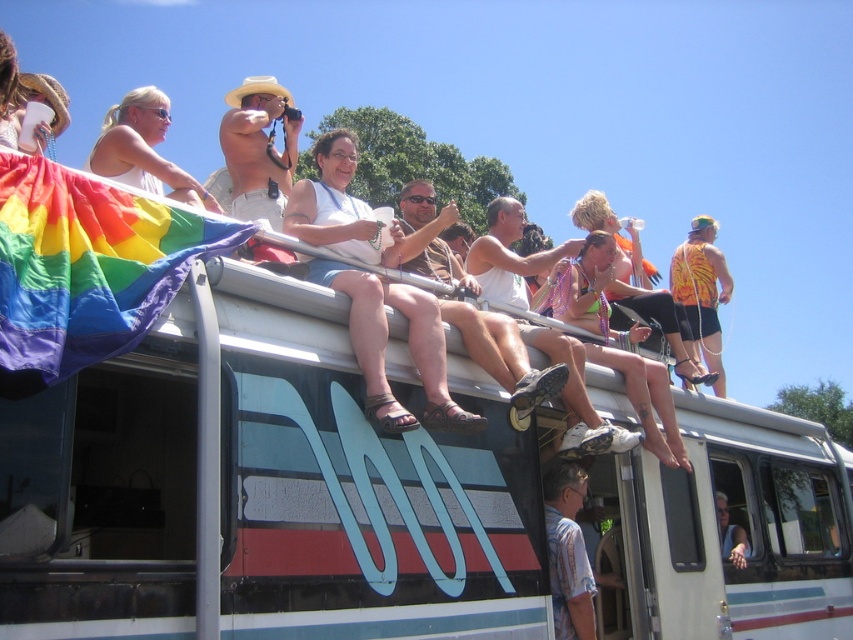
Question: Can you confirm if orange tiger-striped tank top at upper right is smaller than white tank top at upper center?

Choices:
 (A) no
 (B) yes

Answer: (A)

Question: Which is nearer to the orange tiger-striped tank top at upper right?

Choices:
 (A) matte white tank top at upper left
 (B) white tank top at upper center

Answer: (B)

Question: Does matte white tank top at upper left appear over white tank top at upper center?

Choices:
 (A) yes
 (B) no

Answer: (A)

Question: Which point is closer to the camera taking this photo?

Choices:
 (A) (732, 548)
 (B) (701, 243)

Answer: (A)

Question: Is matte white tank top at upper left positioned behind orange tiger-striped tank top at upper right?

Choices:
 (A) no
 (B) yes

Answer: (A)

Question: Which object is farther from the camera taking this photo?

Choices:
 (A) matte white tank top at upper left
 (B) white tank top at upper center
 (C) orange tiger-striped tank top at upper right

Answer: (C)